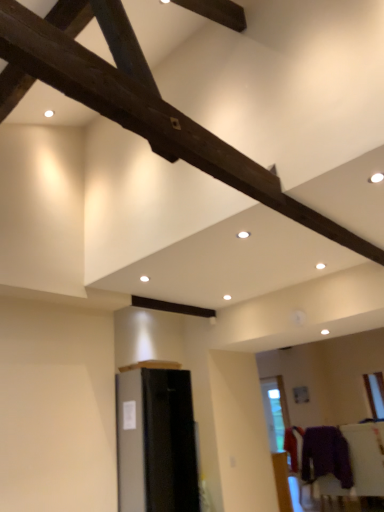
Question: Should I look upward or downward to see satin black refrigerator at lower left, marked as the second furniture in a back-to-front arrangement?

Choices:
 (A) up
 (B) down

Answer: (B)

Question: Does satin black refrigerator at lower left, which appears as the 2th furniture when viewed from the right, have a greater width compared to purple fuzzy sweater at lower right?

Choices:
 (A) yes
 (B) no

Answer: (A)

Question: Is there a large distance between satin black refrigerator at lower left, the 1th furniture positioned from the top, and purple fuzzy sweater at lower right?

Choices:
 (A) yes
 (B) no

Answer: (A)

Question: Considering the relative sizes of satin black refrigerator at lower left, marked as the second furniture in a back-to-front arrangement, and purple fuzzy sweater at lower right in the image provided, is satin black refrigerator at lower left, marked as the second furniture in a back-to-front arrangement, smaller than purple fuzzy sweater at lower right?

Choices:
 (A) yes
 (B) no

Answer: (B)

Question: From the image's perspective, is satin black refrigerator at lower left, the 1th furniture positioned from the top, under purple fuzzy sweater at lower right?

Choices:
 (A) yes
 (B) no

Answer: (B)

Question: Considering the relative sizes of satin black refrigerator at lower left, marked as the second furniture in a back-to-front arrangement, and purple fuzzy sweater at lower right in the image provided, is satin black refrigerator at lower left, marked as the second furniture in a back-to-front arrangement, bigger than purple fuzzy sweater at lower right?

Choices:
 (A) no
 (B) yes

Answer: (B)

Question: From a real-world perspective, is satin black refrigerator at lower left, which appears as the 2th furniture when viewed from the right, positioned over purple fuzzy sweater at lower right based on gravity?

Choices:
 (A) yes
 (B) no

Answer: (A)

Question: Is purple fabric at lower right, which is the second furniture in left-to-right order, located outside purple fuzzy sweater at lower right?

Choices:
 (A) yes
 (B) no

Answer: (A)

Question: Is purple fabric at lower right, which is the second furniture in left-to-right order, next to purple fuzzy sweater at lower right and touching it?

Choices:
 (A) yes
 (B) no

Answer: (B)

Question: Considering the relative sizes of purple fabric at lower right, acting as the first furniture starting from the right, and purple fuzzy sweater at lower right in the image provided, is purple fabric at lower right, acting as the first furniture starting from the right, smaller than purple fuzzy sweater at lower right?

Choices:
 (A) yes
 (B) no

Answer: (A)

Question: Is the depth of purple fabric at lower right, marked as the 1th furniture in a back-to-front arrangement, less than that of purple fuzzy sweater at lower right?

Choices:
 (A) yes
 (B) no

Answer: (B)

Question: Is purple fabric at lower right, which is the second furniture in left-to-right order, far away from purple fuzzy sweater at lower right?

Choices:
 (A) no
 (B) yes

Answer: (A)

Question: Can you confirm if purple fabric at lower right, marked as the 2th furniture in a top-to-bottom arrangement, is taller than purple fuzzy sweater at lower right?

Choices:
 (A) yes
 (B) no

Answer: (A)

Question: Is satin black refrigerator at lower left, which is the second furniture in bottom-to-top order, located outside purple fabric at lower right, marked as the 1th furniture in a back-to-front arrangement?

Choices:
 (A) yes
 (B) no

Answer: (A)